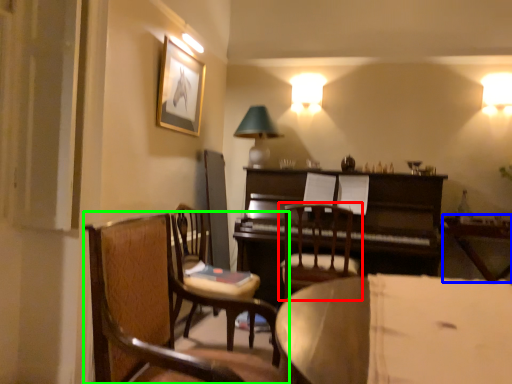
Question: Estimate the real-world distances between objects in this image. Which object is farther from chair (highlighted by a red box), table (highlighted by a blue box) or chair (highlighted by a green box)?

Choices:
 (A) table
 (B) chair

Answer: (B)